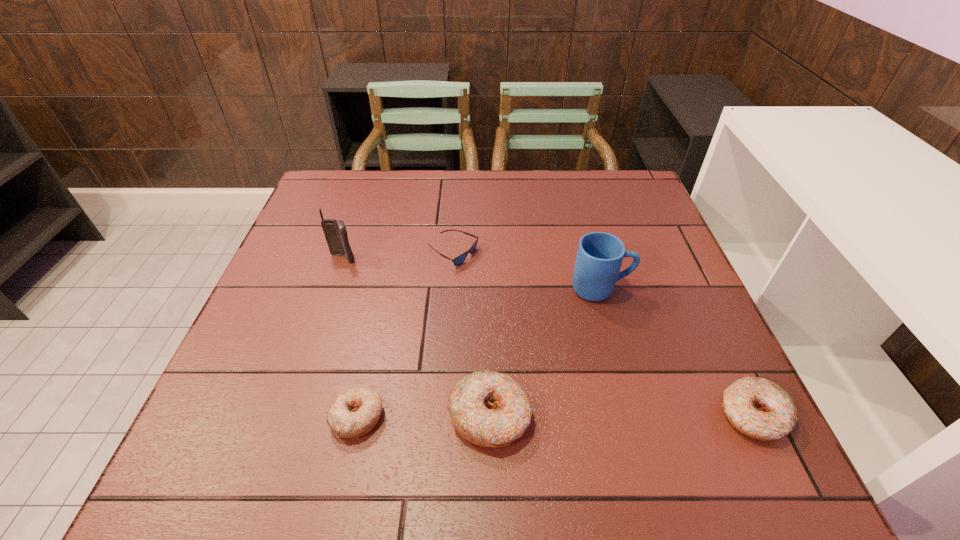
I want to click on the second shortest object, so click(x=353, y=413).

Locate an element on the screen. the shortest doughnut is located at coordinates (353, 413).

Identify the location of the tallest doughnut. Image resolution: width=960 pixels, height=540 pixels. (488, 408).

Image resolution: width=960 pixels, height=540 pixels. I want to click on the second doughnut from right to left, so click(x=488, y=408).

At what (x,y) coordinates should I click in order to perform the action: click on the second shortest doughnut. Please return your answer as a coordinate pair (x, y). This screenshot has height=540, width=960. Looking at the image, I should click on (759, 408).

Where is `the rightmost doughnut`? the rightmost doughnut is located at coordinates (759, 408).

At what (x,y) coordinates should I click in order to perform the action: click on cellular telephone. Please return your answer as a coordinate pair (x, y). The height and width of the screenshot is (540, 960). Looking at the image, I should click on (335, 232).

In order to click on sunglasses in this screenshot , I will do `click(460, 259)`.

The height and width of the screenshot is (540, 960). I want to click on the fourth nearest object, so click(599, 257).

Where is `mug`? The width and height of the screenshot is (960, 540). mug is located at coordinates (599, 257).